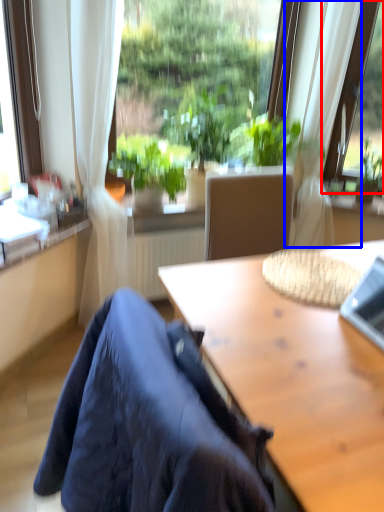
Question: Which point is closer to the camera, window (highlighted by a red box) or curtain (highlighted by a blue box)?

Choices:
 (A) window
 (B) curtain

Answer: (B)